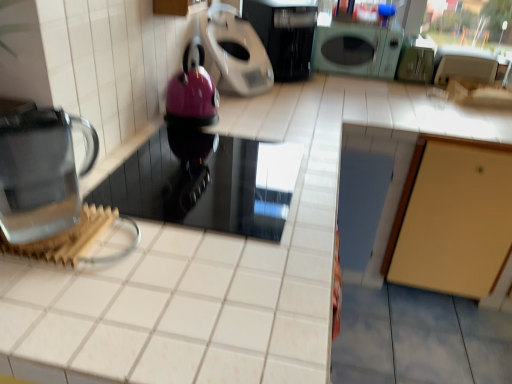
Question: Which direction should I rotate to look at black glossy microwave at upper center, arranged as the second kitchen appliance when viewed from the left, — up or down?

Choices:
 (A) down
 (B) up

Answer: (B)

Question: Does metallic silver scale at upper center, positioned as the 1th kitchen appliance in left-to-right order, have a lesser height compared to transparent glass kettle at left?

Choices:
 (A) yes
 (B) no

Answer: (B)

Question: Would you say metallic silver scale at upper center, positioned as the 1th kitchen appliance in left-to-right order, is outside transparent glass kettle at left?

Choices:
 (A) no
 (B) yes

Answer: (B)

Question: Is the depth of metallic silver scale at upper center, which is counted as the second kitchen appliance, starting from the right, less than that of transparent glass kettle at left?

Choices:
 (A) yes
 (B) no

Answer: (B)

Question: Is metallic silver scale at upper center, which is counted as the second kitchen appliance, starting from the right, at the right side of transparent glass kettle at left?

Choices:
 (A) yes
 (B) no

Answer: (A)

Question: Is metallic silver scale at upper center, which is counted as the second kitchen appliance, starting from the right, positioned behind transparent glass kettle at left?

Choices:
 (A) yes
 (B) no

Answer: (A)

Question: Is metallic silver scale at upper center, positioned as the 1th kitchen appliance in left-to-right order, not close to transparent glass kettle at left?

Choices:
 (A) yes
 (B) no

Answer: (A)

Question: Is transparent glass kettle at left further to camera compared to metallic silver scale at upper center, which is counted as the second kitchen appliance, starting from the right?

Choices:
 (A) yes
 (B) no

Answer: (B)

Question: Does transparent glass kettle at left have a lesser height compared to metallic silver scale at upper center, which is counted as the second kitchen appliance, starting from the right?

Choices:
 (A) yes
 (B) no

Answer: (A)

Question: Is transparent glass kettle at left next to metallic silver scale at upper center, which is counted as the second kitchen appliance, starting from the right?

Choices:
 (A) yes
 (B) no

Answer: (B)

Question: Are transparent glass kettle at left and metallic silver scale at upper center, positioned as the 1th kitchen appliance in left-to-right order, located far from each other?

Choices:
 (A) yes
 (B) no

Answer: (A)

Question: From a real-world perspective, is transparent glass kettle at left positioned over metallic silver scale at upper center, which is counted as the second kitchen appliance, starting from the right, based on gravity?

Choices:
 (A) no
 (B) yes

Answer: (A)

Question: Does transparent glass kettle at left appear on the left side of metallic silver scale at upper center, positioned as the 1th kitchen appliance in left-to-right order?

Choices:
 (A) no
 (B) yes

Answer: (B)

Question: Is black glossy microwave at upper center, arranged as the second kitchen appliance when viewed from the left, further to the viewer compared to transparent glass kettle at left?

Choices:
 (A) no
 (B) yes

Answer: (B)